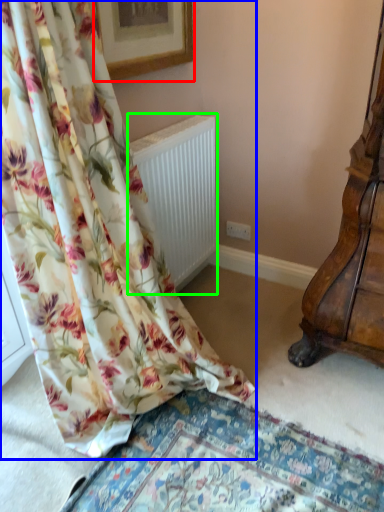
Question: Estimate the real-world distances between objects in this image. Which object is farther from picture frame (highlighted by a red box), curtain (highlighted by a blue box) or radiator (highlighted by a green box)?

Choices:
 (A) curtain
 (B) radiator

Answer: (A)